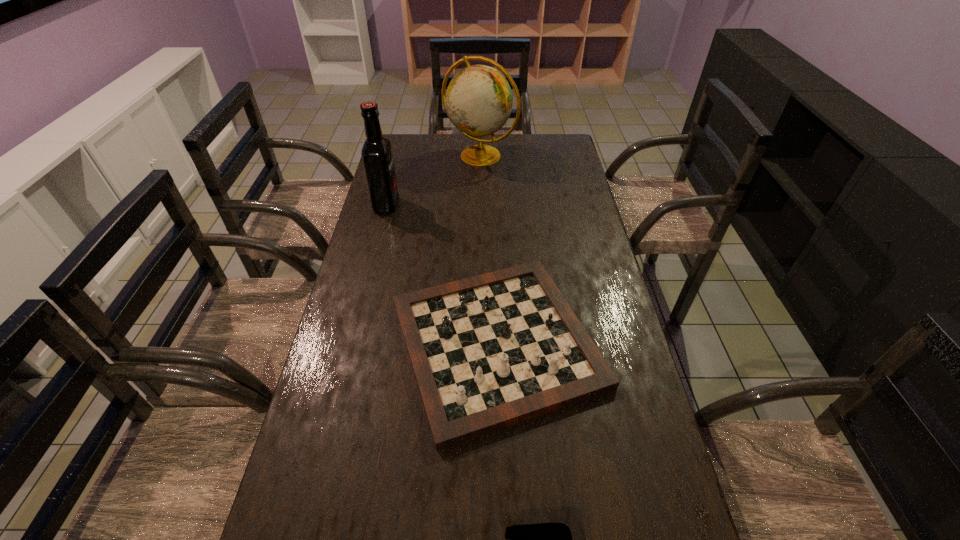
Locate an element on the screen. object that is the third closest to the globe is located at coordinates coord(539,539).

The height and width of the screenshot is (540, 960). I want to click on vacant area that satisfies the following two spatial constraints: 1. on the front side of the farthest object; 2. on the left side of the second shortest object, so click(480, 343).

You are a GUI agent. You are given a task and a screenshot of the screen. Output one action in this format:
    pyautogui.click(x=<x>, y=<y>)
    Task: Click on the vacant region that satisfies the following two spatial constraints: 1. on the front-facing side of the second shortest object; 2. on the left side of the leftmost object
    
    Given the screenshot: What is the action you would take?
    pyautogui.click(x=351, y=343)